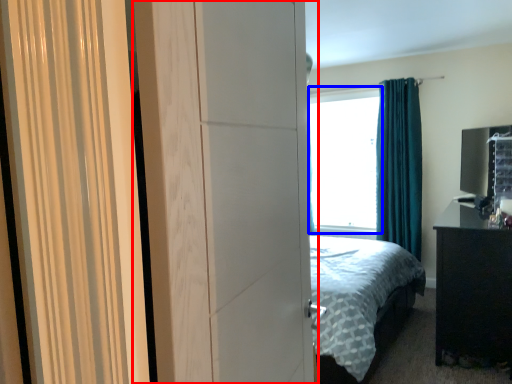
Question: Which object is closer to the camera taking this photo, screen door (highlighted by a red box) or window screen (highlighted by a blue box)?

Choices:
 (A) screen door
 (B) window screen

Answer: (A)